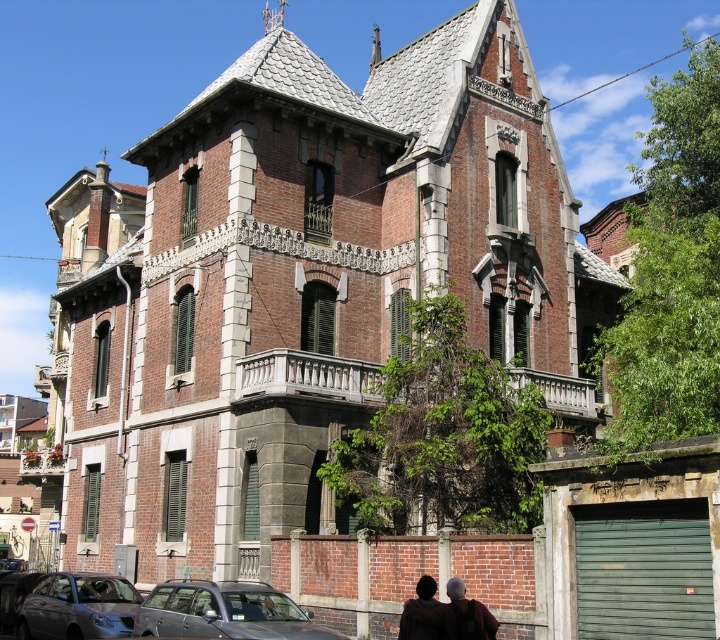
You are a pedestrian standing in front of the historic building. You see the matte gray car at lower left and the matte brown hair at lower center. Which object is positioned lower in the image?

The matte gray car at lower left is located below the matte brown hair at lower center, so it is positioned lower in the image.

You are a photographer standing in front of the historic building. You notice the matte brown hair at lower center and the shiny black car at lower left. Which object is positioned higher in the image?

The matte brown hair at lower center is located above the shiny black car at lower left, so it is positioned higher in the image.

You are standing in front of the historic building and notice a point marked at coordinates (454,614). What does this point represent?

The point at (454,614) represents the matte brown hair at lower center.